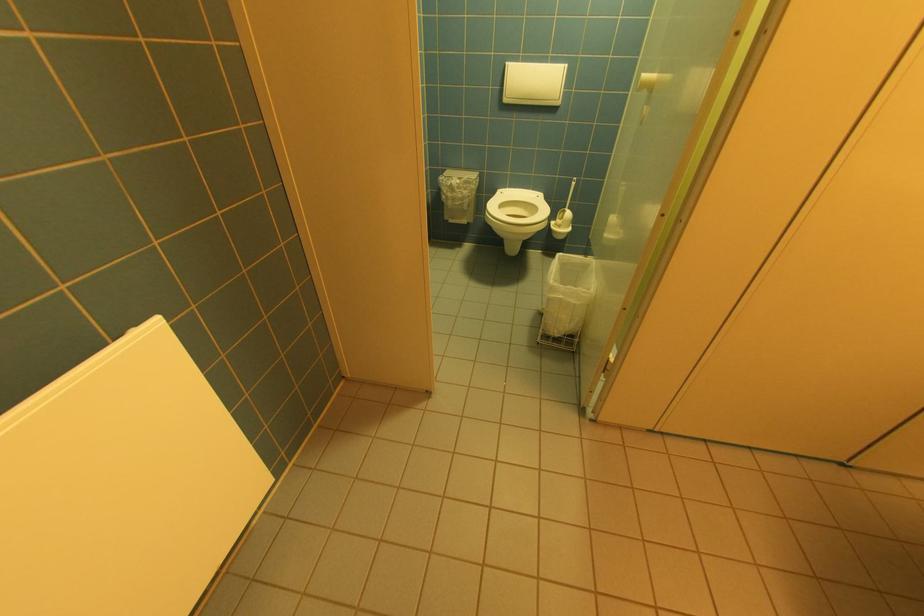
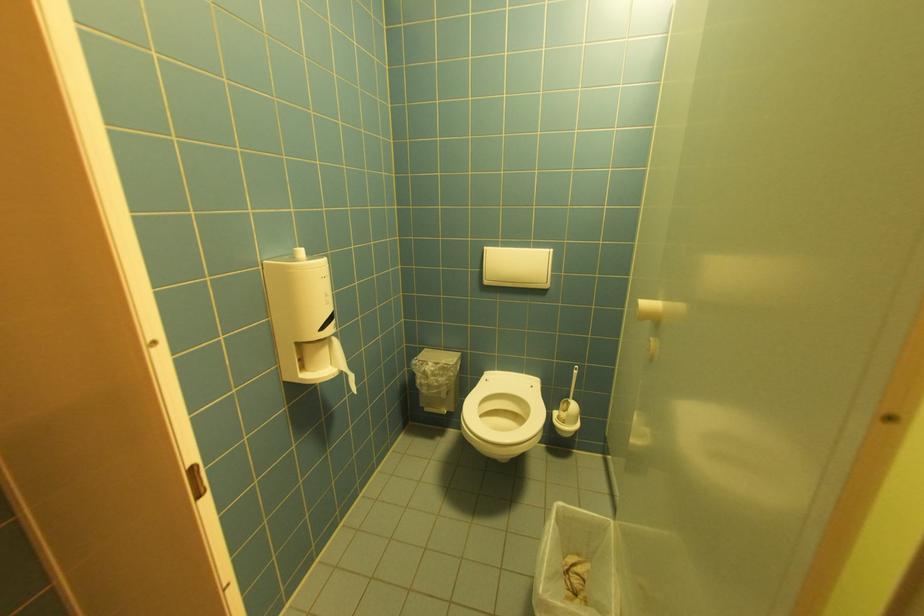
Find the pixel in the second image that matches the point at 512,100 in the first image.

(492, 283)